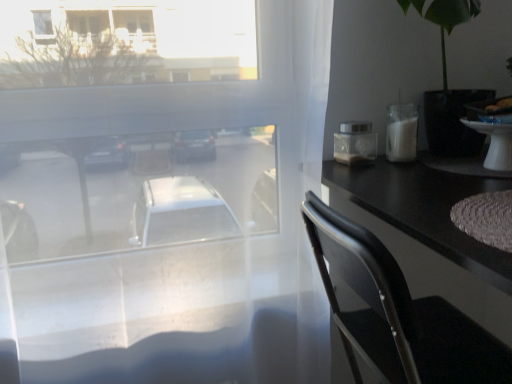
This screenshot has height=384, width=512. In order to click on black plastic chair at right in this screenshot , I will do `click(398, 313)`.

Identify the location of black plastic chair at right. tap(398, 313).

From the image's perspective, relative to transparent glass window at center, is white glossy table at right above or below?

Based on their image positions, white glossy table at right is located above transparent glass window at center.

Consider the image. Can you confirm if white glossy table at right is positioned to the left of transparent glass window at center?

Incorrect, white glossy table at right is not on the left side of transparent glass window at center.

Locate an element on the screen. This screenshot has width=512, height=384. window below the white glossy table at right (from the image's perspective) is located at coordinates (185, 245).

How distant is white glossy table at right from transparent glass window at center?

white glossy table at right and transparent glass window at center are 25.98 inches apart.

Is transparent glass window at center closer to the viewer compared to black plastic chair at right?

That is False.

Does point (146, 372) appear closer or farther from the camera than point (314, 236)?

Point (146, 372) is farther from the camera than point (314, 236).

Is transparent glass window at center not within black plastic chair at right?

transparent glass window at center lies outside black plastic chair at right's area.

Can you confirm if transparent glass window at center is positioned to the left of black plastic chair at right?

Yes, transparent glass window at center is to the left of black plastic chair at right.

Is white glossy table at right far from black plastic chair at right?

white glossy table at right is near black plastic chair at right, not far away.

Which object is further away from the camera, white glossy table at right or black plastic chair at right?

Positioned behind is white glossy table at right.

Which is behind, point (498, 151) or point (458, 322)?

The point (458, 322) is farther.

Between white glossy table at right and black plastic chair at right, which one has larger size?

black plastic chair at right is bigger.

From the image's perspective, who appears lower, transparent glass window at center or white glossy table at right?

transparent glass window at center is shown below in the image.

From a real-world perspective, between transparent glass window at center and white glossy table at right, who is vertically lower?

In real-world perspective, transparent glass window at center is lower.

Considering the positions of point (143, 268) and point (471, 121), is point (143, 268) closer or farther from the camera than point (471, 121)?

Point (143, 268) is positioned farther from the camera compared to point (471, 121).

Is black plastic chair at right taller or shorter than white glossy table at right?

Clearly, black plastic chair at right is taller compared to white glossy table at right.

How different are the orientations of black plastic chair at right and white glossy table at right in degrees?

The facing directions of black plastic chair at right and white glossy table at right are 2.09e-05 degrees apart.

In the scene shown: In terms of width, does black plastic chair at right look wider or thinner when compared to white glossy table at right?

Clearly, black plastic chair at right has more width compared to white glossy table at right.

Is black plastic chair at right far from white glossy table at right?

No, there isn't a large distance between black plastic chair at right and white glossy table at right.

Is black plastic chair at right behind transparent glass window at center?

No.

Is point (352, 356) farther from camera compared to point (184, 287)?

No.

Is black plastic chair at right far away from transparent glass window at center?

No, there isn't a large distance between black plastic chair at right and transparent glass window at center.

From a real-world perspective, is black plastic chair at right positioned above or below transparent glass window at center?

In terms of real-world spatial position, black plastic chair at right is below transparent glass window at center.

Where is `table lying on the right of transparent glass window at center`? The width and height of the screenshot is (512, 384). table lying on the right of transparent glass window at center is located at coordinates [495, 144].

Locate an element on the screen. This screenshot has width=512, height=384. chair below the transparent glass window at center (from a real-world perspective) is located at coordinates (398, 313).

From the image, which object appears to be farther from black plastic chair at right, white glossy table at right or transparent glass window at center?

Among the two, white glossy table at right is located further to black plastic chair at right.

Estimate the real-world distances between objects in this image. Which object is closer to white glossy table at right, black plastic chair at right or transparent glass window at center?

black plastic chair at right is closer to white glossy table at right.

When comparing their distances from transparent glass window at center, does white glossy table at right or black plastic chair at right seem closer?

Based on the image, black plastic chair at right appears to be nearer to transparent glass window at center.

Estimate the real-world distances between objects in this image. Which object is closer to white glossy table at right, transparent glass window at center or black plastic chair at right?

Among the two, black plastic chair at right is located nearer to white glossy table at right.

Consider the image. Considering their positions, is black plastic chair at right positioned closer to transparent glass window at center than white glossy table at right?

black plastic chair at right is positioned closer to the anchor transparent glass window at center.

Estimate the real-world distances between objects in this image. Which object is closer to black plastic chair at right, transparent glass window at center or white glossy table at right?

transparent glass window at center is positioned closer to the anchor black plastic chair at right.

Identify the location of chair between transparent glass window at center and white glossy table at right in the horizontal direction. (398, 313).